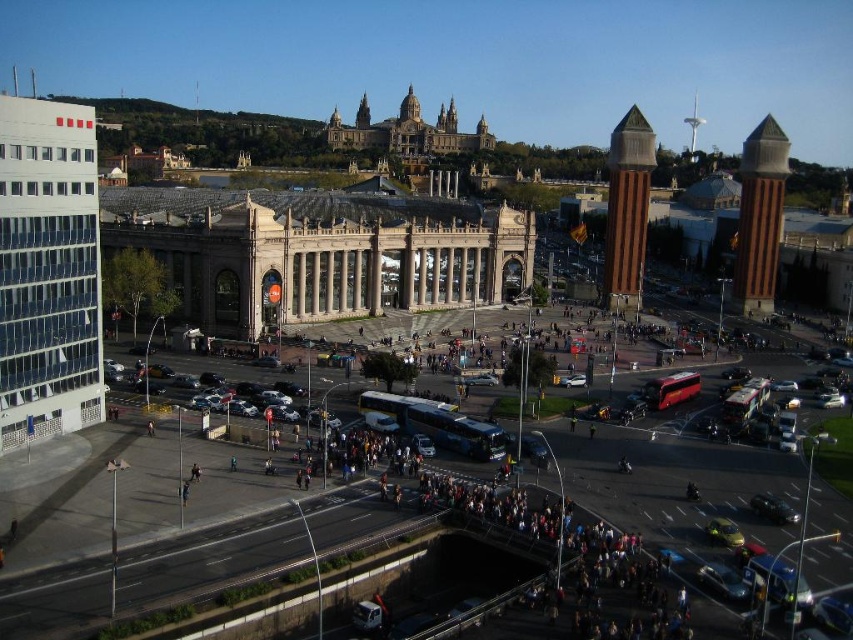
Question: Is brown stone tower at right wider than brown brick tower at center-right?

Choices:
 (A) no
 (B) yes

Answer: (B)

Question: Which point is closer to the camera?

Choices:
 (A) brown stone tower at right
 (B) brown brick tower at center-right

Answer: (A)

Question: Which of the following is the farthest from the observer?

Choices:
 (A) brown stone tower at right
 (B) brown brick tower at center-right

Answer: (B)

Question: Where is brown stone tower at right located in relation to brown brick tower at center-right in the image?

Choices:
 (A) right
 (B) left

Answer: (A)

Question: Is brown stone tower at right in front of brown brick tower at center-right?

Choices:
 (A) yes
 (B) no

Answer: (A)